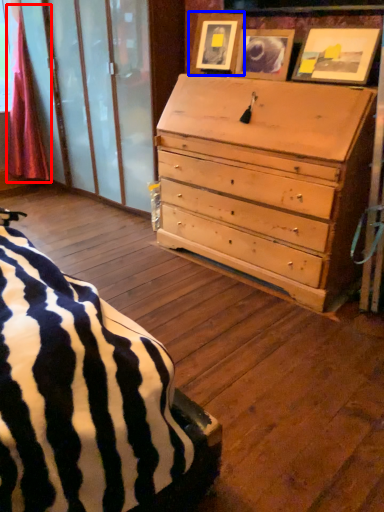
Question: Which of the following is the closest to the observer, curtain (highlighted by a red box) or picture frame (highlighted by a blue box)?

Choices:
 (A) curtain
 (B) picture frame

Answer: (B)